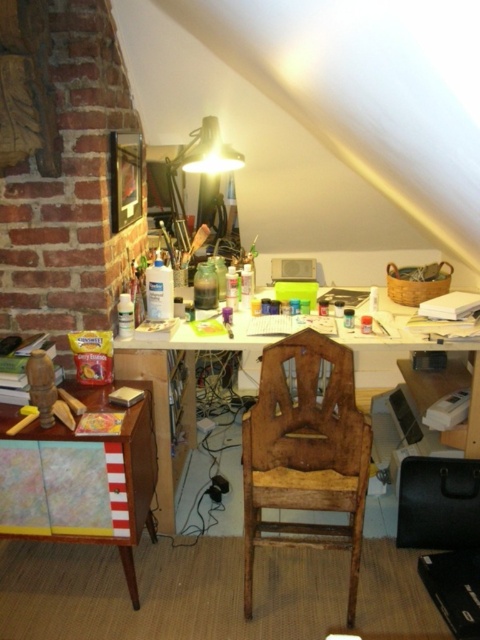
Question: Observing the image, what is the correct spatial positioning of wooden desk at center in reference to wooden cabinet at lower left?

Choices:
 (A) below
 (B) above

Answer: (B)

Question: Which object is farther from the camera taking this photo?

Choices:
 (A) wooden cabinet at lower left
 (B) wooden chair at center

Answer: (A)

Question: Is wooden chair at center closer to the viewer compared to wooden desk at center?

Choices:
 (A) yes
 (B) no

Answer: (A)

Question: Observing the image, what is the correct spatial positioning of wooden desk at center in reference to wooden cabinet at lower left?

Choices:
 (A) left
 (B) right

Answer: (B)

Question: Which point appears farthest from the camera in this image?

Choices:
 (A) (288, 541)
 (B) (164, 401)
 (C) (1, 435)

Answer: (B)

Question: Estimate the real-world distances between objects in this image. Which object is farther from the wooden chair at center?

Choices:
 (A) wooden desk at center
 (B) wooden cabinet at lower left

Answer: (A)